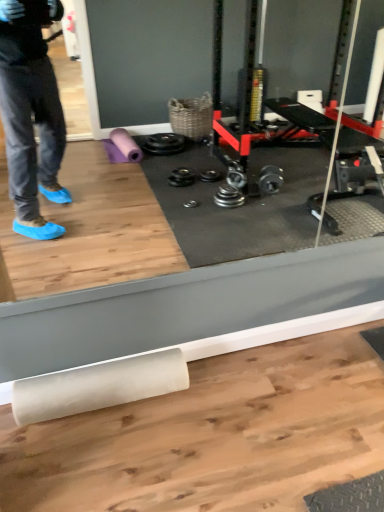
Where is `vacant point above white matte paper towel at lower center (from a real-world perspective)`? This screenshot has width=384, height=512. vacant point above white matte paper towel at lower center (from a real-world perspective) is located at coordinates (102, 371).